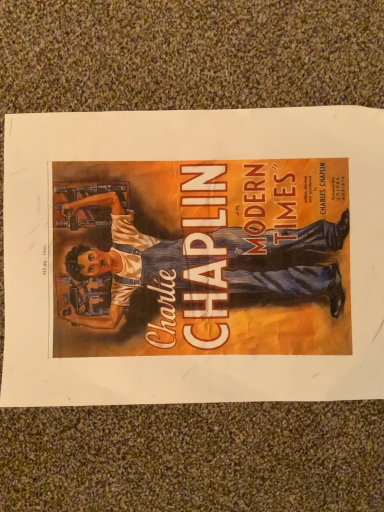
The height and width of the screenshot is (512, 384). What do you see at coordinates (194, 256) in the screenshot?
I see `matte blue overalls at center` at bounding box center [194, 256].

Where is `matte blue overalls at center`? This screenshot has height=512, width=384. matte blue overalls at center is located at coordinates (194, 256).

Measure the distance between point (374, 354) and camera.

Point (374, 354) and camera are 11.97 inches apart from each other.

The height and width of the screenshot is (512, 384). I want to click on matte blue overalls at center, so click(194, 256).